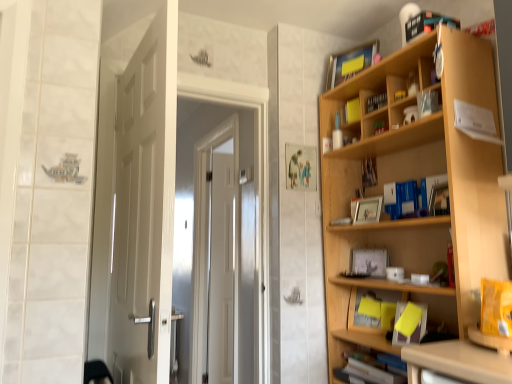
Question: From a real-world perspective, is matte plastic book at upper right, arranged as the fifth book when viewed from the top, physically located above or below yellow matte bookshelf at upper center, the fourth book when ordered from top to bottom?

Choices:
 (A) above
 (B) below

Answer: (B)

Question: Relative to yellow matte bookshelf at upper center, the fourth book when ordered from top to bottom, is matte plastic book at upper right, arranged as the fifth book when viewed from the top, in front or behind?

Choices:
 (A) behind
 (B) front

Answer: (B)

Question: Which object is positioned farthest from the yellow paper at lower right, which is the tenth book in top-to-bottom order?

Choices:
 (A) yellow matte bookshelf at upper center, the fourth book when ordered from top to bottom
 (B) white glossy door at left
 (C) matte yellow book at upper right, positioned as the 9th book in bottom-to-top order
 (D) green matte bookshelf at upper center, marked as the 5th book in a bottom-to-top arrangement
 (E) light wood bookcase at right

Answer: (B)

Question: Considering the real-world distances, which object is closest to the wooden photo frame at upper right, arranged as the 3th book when ordered from the bottom?

Choices:
 (A) white glossy door at center
 (B) matte yellow book at upper right, positioned as the 9th book in bottom-to-top order
 (C) yellow matte bookshelf at upper center, the fourth book when ordered from top to bottom
 (D) white glossy door at left
 (E) white paper at upper right, which is the fourth book from bottom to top

Answer: (C)